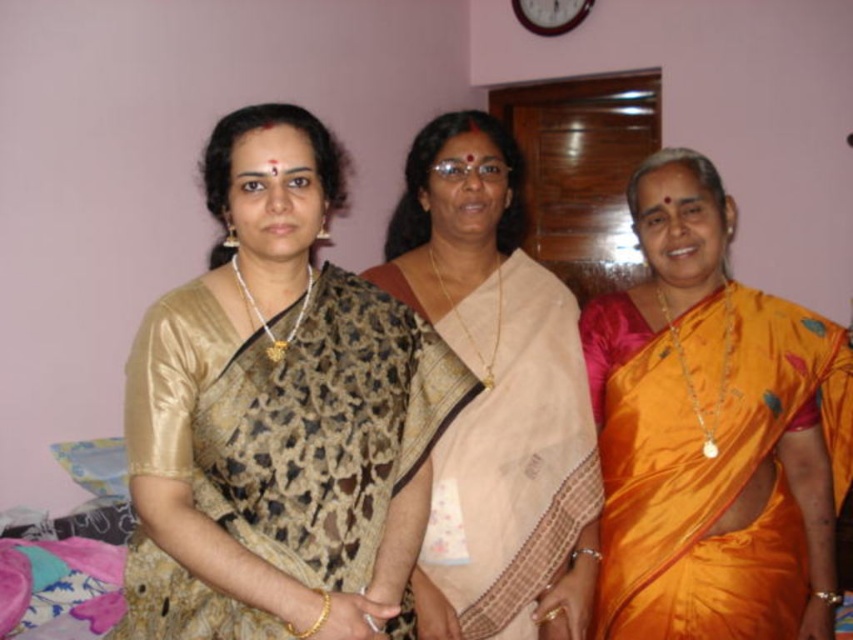
Does gold silk saree at left have a greater width compared to beige silk saree at center?

Yes.

Between gold silk saree at left and beige silk saree at center, which one appears on the right side from the viewer's perspective?

beige silk saree at center is more to the right.

This screenshot has height=640, width=853. Identify the location of gold silk saree at left. (279, 417).

What are the coordinates of `gold silk saree at left` in the screenshot? It's located at (279, 417).

Who is positioned more to the left, gold silk saree at left or orange satin saree at right?

gold silk saree at left

Looking at this image, does gold silk saree at left have a greater height compared to orange satin saree at right?

Incorrect, gold silk saree at left's height is not larger of orange satin saree at right's.

Does point (258, 502) come behind point (761, 636)?

That is False.

Find the location of a particular element. gold silk saree at left is located at coordinates (279, 417).

Between orange satin saree at right and beige silk saree at center, which one has less height?

With less height is orange satin saree at right.

Between orange satin saree at right and beige silk saree at center, which one appears on the left side from the viewer's perspective?

Positioned to the left is beige silk saree at center.

At what (x,y) coordinates should I click in order to perform the action: click on orange satin saree at right. Please return your answer as a coordinate pair (x, y). This screenshot has width=853, height=640. Looking at the image, I should click on (709, 433).